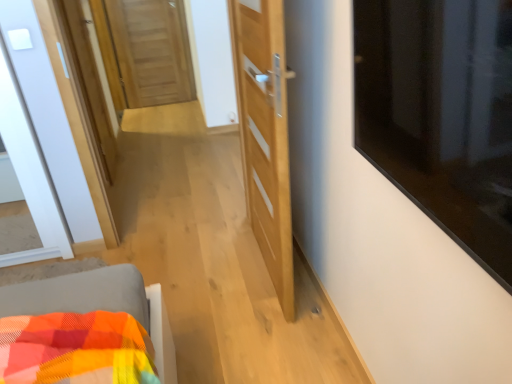
Question: From the image's perspective, is transparent glass window at upper right above or below light wood door at center, which is the second door in top-to-bottom order?

Choices:
 (A) above
 (B) below

Answer: (B)

Question: Relative to light wood door at center, which is the second door in top-to-bottom order, is transparent glass window at upper right in front or behind?

Choices:
 (A) behind
 (B) front

Answer: (B)

Question: Which is nearer to the light wood door at center, arranged as the first door when ordered from the bottom?

Choices:
 (A) transparent glass window at upper right
 (B) wooden door at center, the second door positioned from the right

Answer: (A)

Question: Based on their relative distances, which object is nearer to the light wood door at center, which is the first door from right to left?

Choices:
 (A) wooden door at center, the 1th door in the left-to-right sequence
 (B) transparent glass window at upper right

Answer: (B)